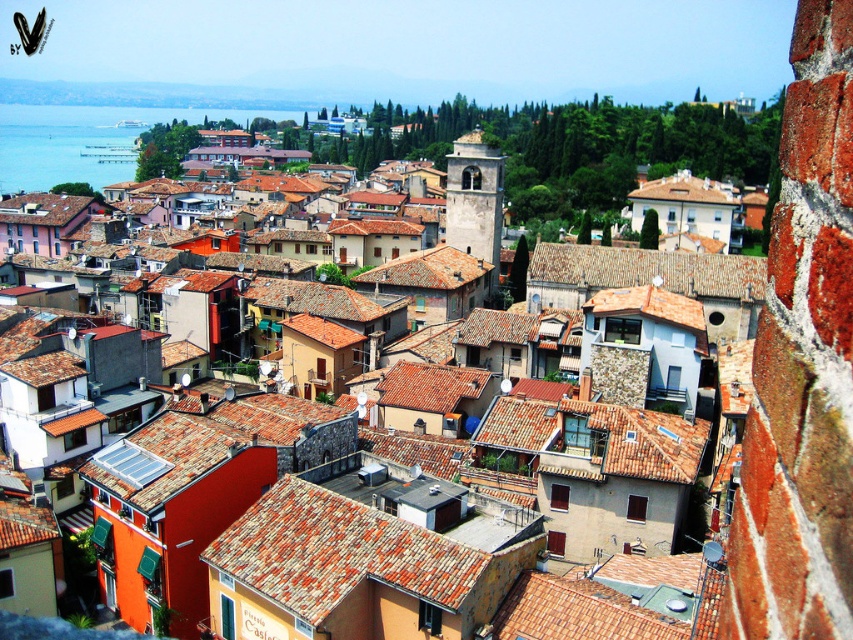
You are a tourist standing in the town square and want to take a photo that includes both the brown clay roof tiles at center and the blue water at left. Which object should you position closer to the edge of the frame to ensure both are visible?

You should position the blue water at left closer to the edge of the frame because the brown clay roof tiles at center is thinner than the blue water at left, meaning the blue water at left occupies more space and needs to be adjusted to fit both within the frame.

You are a tourist standing in the town and want to take a photo of the blue water at left and the brown clay roof tiles at center. Which object should you point your camera towards first if you want to capture both in one shot?

You should point your camera towards the blue water at left first because the brown clay roof tiles at center is to the right of blue water at left, so capturing the blue water at left first will allow the brown clay roof tiles at center to be included in the right side of the frame.